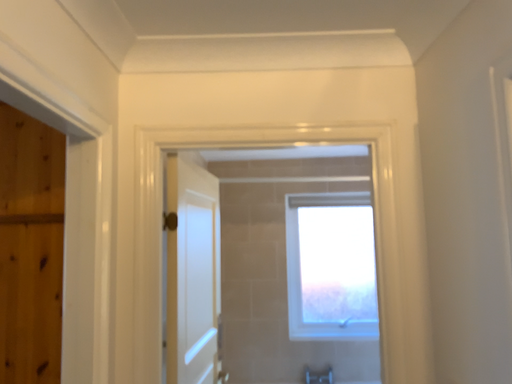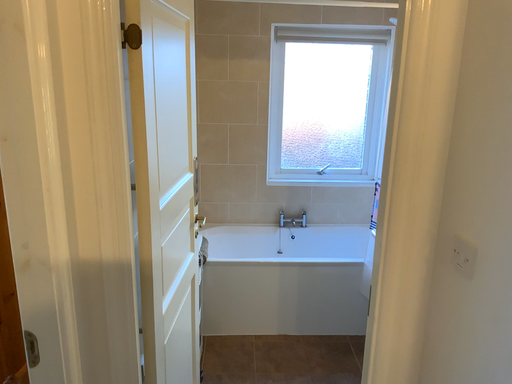
Question: How did the camera likely rotate when shooting the video?

Choices:
 (A) rotated upward
 (B) rotated downward

Answer: (B)